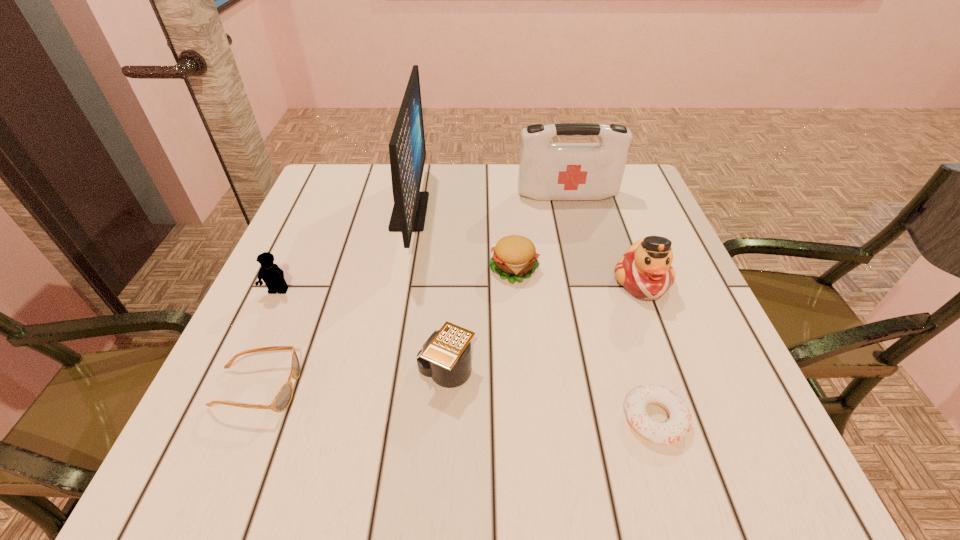
Identify the location of vacant space situated 0.210m on the front side of the seventh shortest object. The height and width of the screenshot is (540, 960). (582, 255).

Find the location of a particular element. The height and width of the screenshot is (540, 960). vacant area situated 0.310m on the face of the sixth shortest object is located at coordinates (709, 461).

This screenshot has height=540, width=960. Identify the location of vacant space situated 0.120m on the front-facing side of the Lego. click(253, 346).

I want to click on vacant region located on the right of the calculator, so click(x=510, y=370).

Identify the location of free region located 0.190m on the front of the hamburger. (522, 363).

The image size is (960, 540). In order to click on vacant space located 0.350m on the front-facing side of the sunglasses in this screenshot , I will do `click(504, 388)`.

Locate an element on the screen. free space located on the left of the shortest object is located at coordinates (398, 418).

At what (x,y) coordinates should I click in order to perform the action: click on computer monitor at the far edge. Please return your answer as a coordinate pair (x, y). Image resolution: width=960 pixels, height=540 pixels. Looking at the image, I should click on (407, 151).

In order to click on the first-aid kit that is at the far edge in this screenshot , I will do `click(547, 171)`.

Locate an element on the screen. The image size is (960, 540). object present at the near edge is located at coordinates (679, 423).